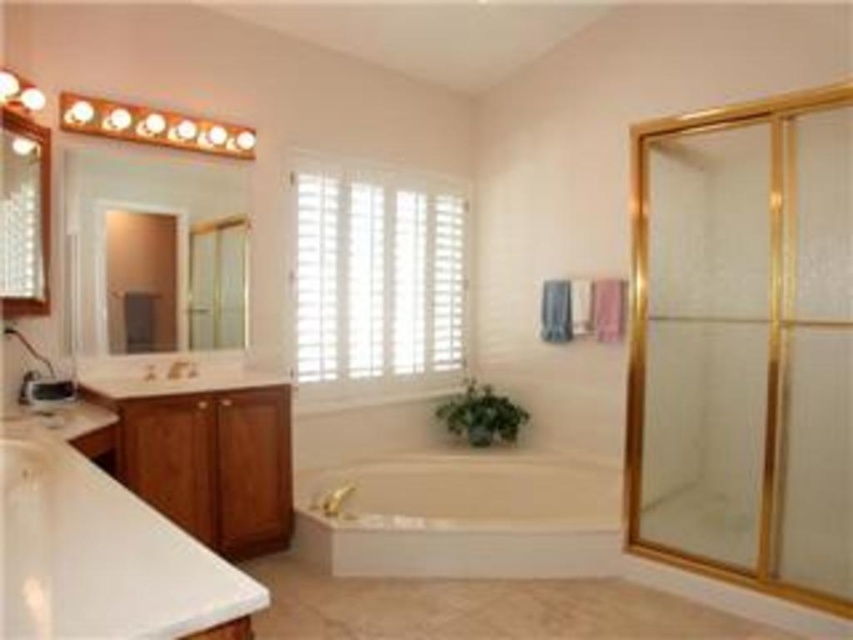
Who is positioned more to the left, white glossy countertop at lower left or matte glass mirror at upper left?

From the viewer's perspective, matte glass mirror at upper left appears more on the left side.

Is white glossy countertop at lower left above matte glass mirror at upper left?

Incorrect, white glossy countertop at lower left is not positioned above matte glass mirror at upper left.

Find the location of a particular element. This screenshot has width=853, height=640. white glossy countertop at lower left is located at coordinates (x=102, y=557).

Is clear glass shower door at right positioned at the back of white glossy countertop at lower left?

Yes, it is behind white glossy countertop at lower left.

Consider the image. Can you confirm if clear glass shower door at right is wider than white glossy countertop at lower left?

Incorrect, clear glass shower door at right's width does not surpass white glossy countertop at lower left's.

Who is more distant from viewer, (776,426) or (125,500)?

The point (776,426) is more distant.

Find the location of a particular element. clear glass shower door at right is located at coordinates (744, 344).

Who is shorter, wooden counter top at lower left or brushed metal faucet at left?

Standing shorter between the two is brushed metal faucet at left.

In the scene shown: Does wooden counter top at lower left appear under brushed metal faucet at left?

Yes, wooden counter top at lower left is below brushed metal faucet at left.

At what (x,y) coordinates should I click in order to perform the action: click on wooden counter top at lower left. Please return your answer as a coordinate pair (x, y). This screenshot has height=640, width=853. Looking at the image, I should click on (172, 378).